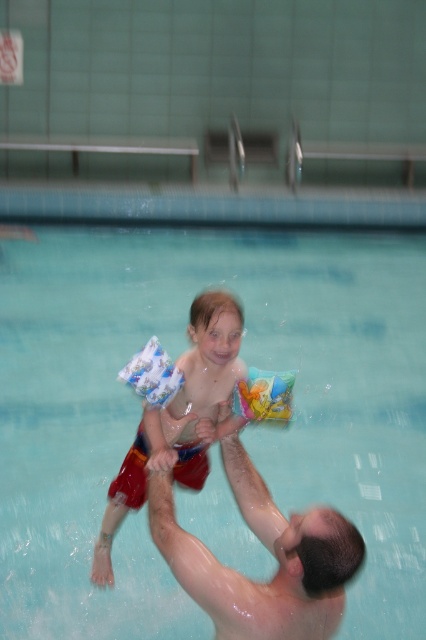
From the picture: Is shiny wet skin at center bigger than white printed floaties at center?

Correct, shiny wet skin at center is larger in size than white printed floaties at center.

Does shiny wet skin at center appear over white printed floaties at center?

No.

The image size is (426, 640). Describe the element at coordinates (270, 552) in the screenshot. I see `shiny wet skin at center` at that location.

You are a GUI agent. You are given a task and a screenshot of the screen. Output one action in this format:
    pyautogui.click(x=<x>, y=<y>)
    Task: Click on the shiny wet skin at center
    
    Given the screenshot: What is the action you would take?
    pyautogui.click(x=270, y=552)

What do you see at coordinates (180, 353) in the screenshot? I see `clear blue water at center` at bounding box center [180, 353].

From the picture: Can you confirm if clear blue water at center is positioned to the right of white printed floaties at center?

Incorrect, clear blue water at center is not on the right side of white printed floaties at center.

Image resolution: width=426 pixels, height=640 pixels. Identify the location of clear blue water at center. (180, 353).

In order to click on clear blue water at center in this screenshot , I will do `click(180, 353)`.

Describe the element at coordinates (270, 552) in the screenshot. This screenshot has height=640, width=426. I see `shiny wet skin at center` at that location.

The width and height of the screenshot is (426, 640). In order to click on shiny wet skin at center in this screenshot , I will do `click(270, 552)`.